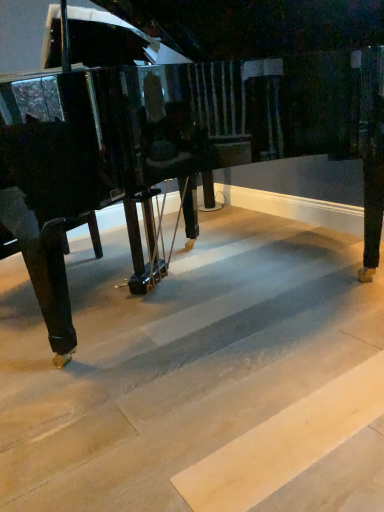
Question: From the image's perspective, relative to light wood stair at center, is glossy black piano at center above or below?

Choices:
 (A) above
 (B) below

Answer: (A)

Question: In terms of height, does glossy black piano at center look taller or shorter compared to light wood stair at center?

Choices:
 (A) short
 (B) tall

Answer: (B)

Question: In the image, is glossy black piano at center on the left side or the right side of light wood stair at center?

Choices:
 (A) left
 (B) right

Answer: (B)

Question: In terms of width, does light wood stair at center look wider or thinner when compared to glossy black piano at center?

Choices:
 (A) thin
 (B) wide

Answer: (B)

Question: From a real-world perspective, is light wood stair at center positioned above or below glossy black piano at center?

Choices:
 (A) below
 (B) above

Answer: (A)

Question: In the image, is light wood stair at center on the left side or the right side of glossy black piano at center?

Choices:
 (A) right
 (B) left

Answer: (B)

Question: In terms of size, does light wood stair at center appear bigger or smaller than glossy black piano at center?

Choices:
 (A) small
 (B) big

Answer: (A)